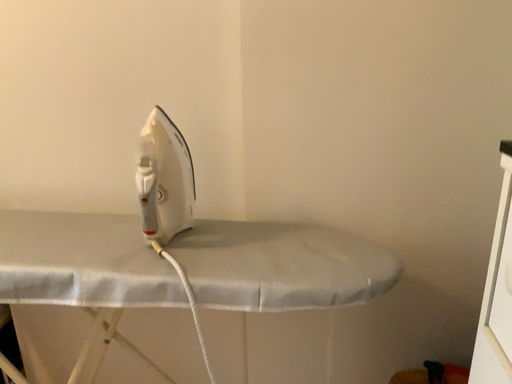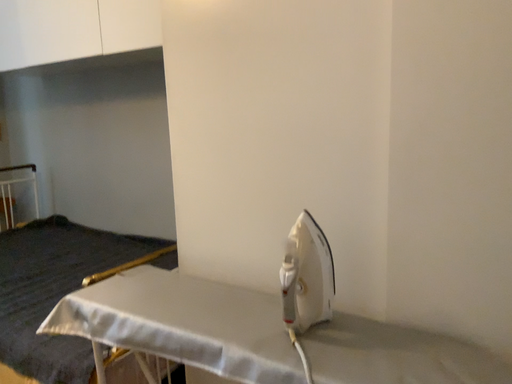
Question: How did the camera likely rotate when shooting the video?

Choices:
 (A) rotated upward
 (B) rotated downward

Answer: (A)